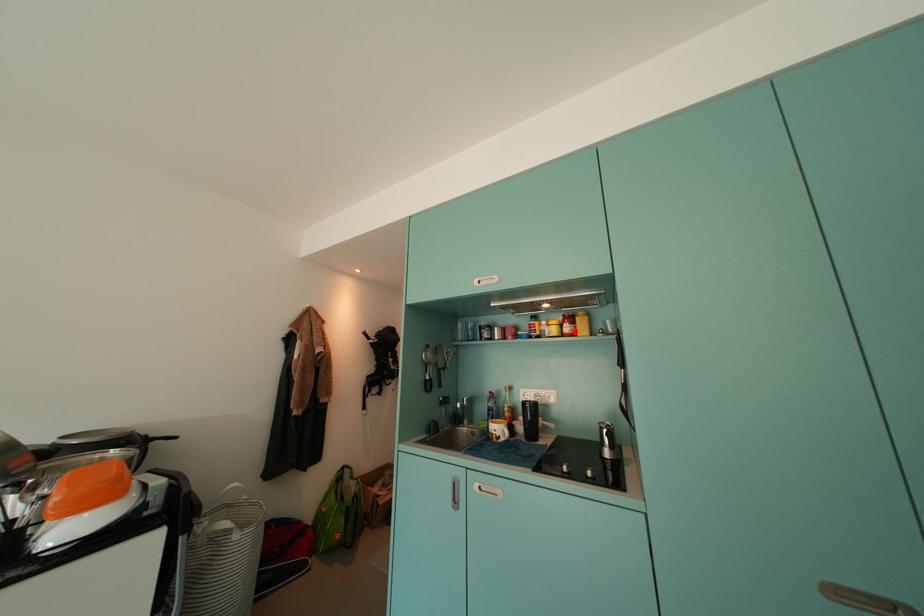
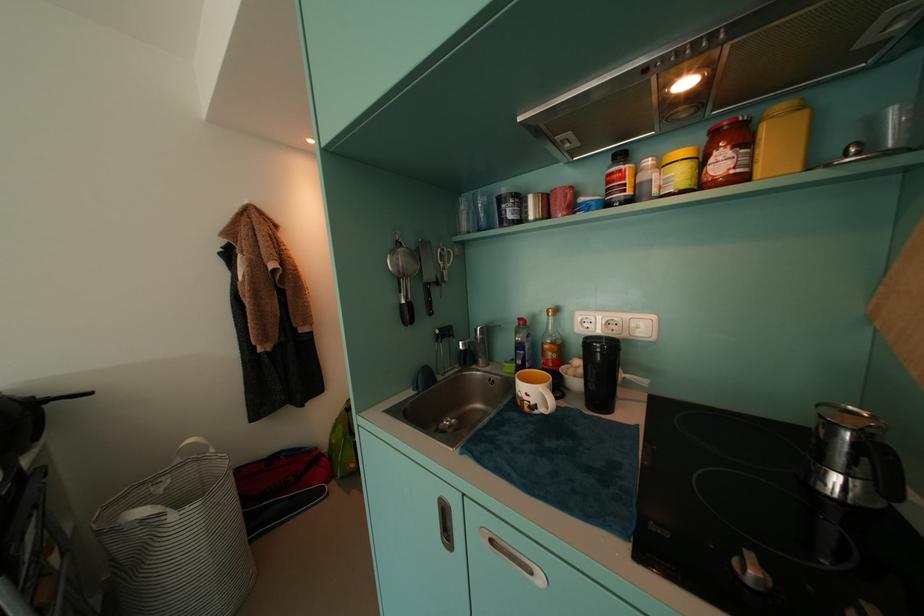
The point at the highlighted location is marked in the first image. Where is the corresponding point in the second image?

(730, 166)